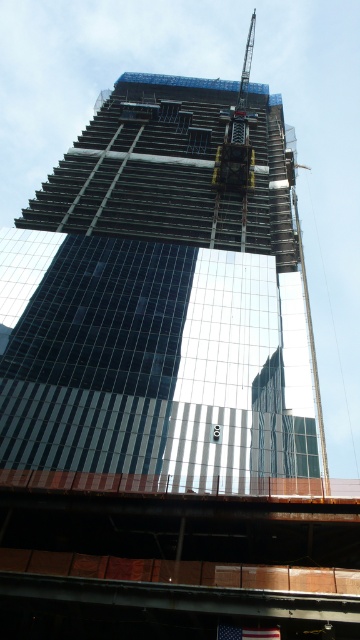
Does glassy reflective skyscraper at center have a smaller size compared to metallic gray crane at upper center?

Correct, glassy reflective skyscraper at center occupies less space than metallic gray crane at upper center.

Who is shorter, glassy reflective skyscraper at center or metallic gray crane at upper center?

With less height is glassy reflective skyscraper at center.

Does point (171, 416) lie in front of point (245, 128)?

Yes, point (171, 416) is in front of point (245, 128).

At what (x,y) coordinates should I click in order to perform the action: click on glassy reflective skyscraper at center. Please return your answer as a coordinate pair (x, y). Looking at the image, I should click on (163, 304).